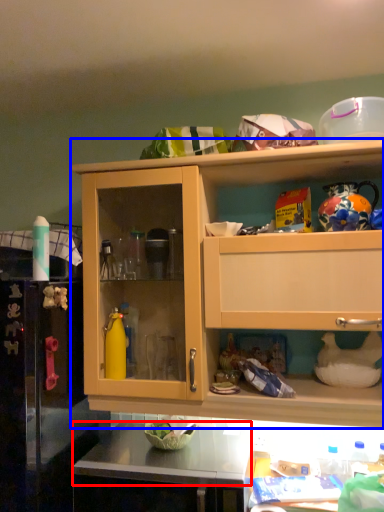
Question: Which of the following is the closest to the observer, counter top (highlighted by a red box) or cabinetry (highlighted by a blue box)?

Choices:
 (A) counter top
 (B) cabinetry

Answer: (A)